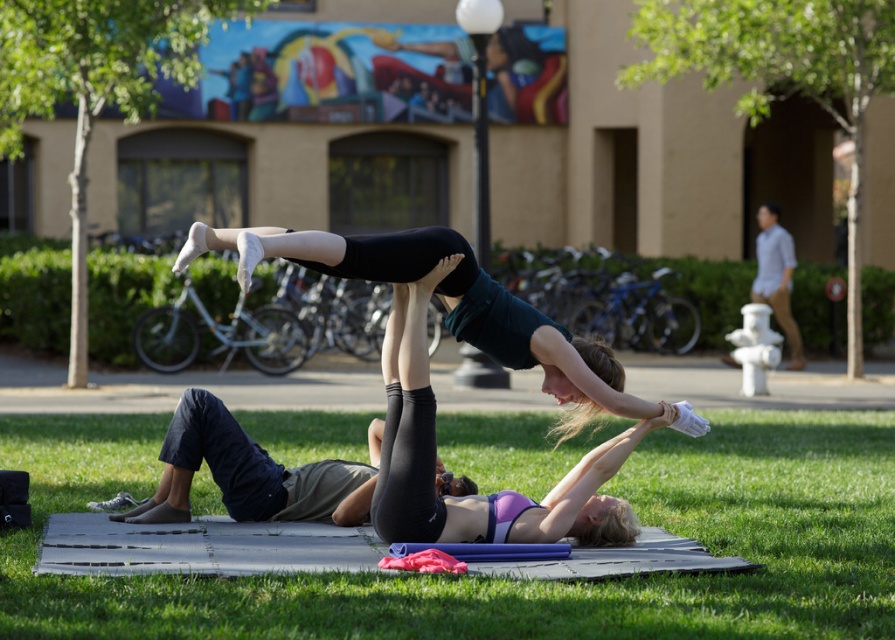
Is matte black leggings at center bigger than black matte yoga pose at center?

Actually, matte black leggings at center might be smaller than black matte yoga pose at center.

Can you confirm if matte black leggings at center is positioned to the left of black matte yoga pose at center?

No, matte black leggings at center is not to the left of black matte yoga pose at center.

Locate an element on the screen. The height and width of the screenshot is (640, 895). matte black leggings at center is located at coordinates (435, 452).

The width and height of the screenshot is (895, 640). In order to click on matte black leggings at center in this screenshot , I will do `click(435, 452)`.

Is green grass at lower center above matte black leggings at center?

Incorrect, green grass at lower center is not positioned above matte black leggings at center.

Which is behind, point (891, 577) or point (609, 540)?

The point (609, 540) is more distant.

The image size is (895, 640). In order to click on green grass at lower center in this screenshot , I will do `click(508, 579)`.

Is green grass at lower center shorter than black matte yoga pose at center?

Indeed, green grass at lower center has a lesser height compared to black matte yoga pose at center.

I want to click on green grass at lower center, so click(x=508, y=579).

Identify the location of green grass at lower center. Image resolution: width=895 pixels, height=640 pixels. (508, 579).